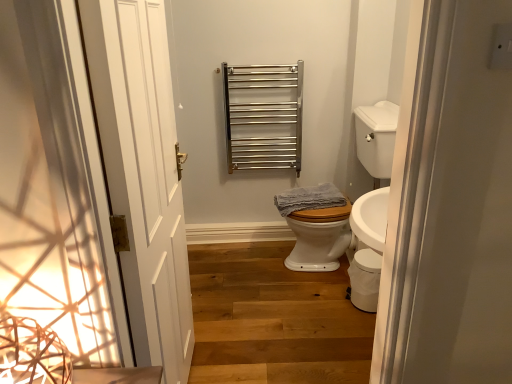
Identify the location of vacant space behind white glossy toilet bowl at lower right. (339, 284).